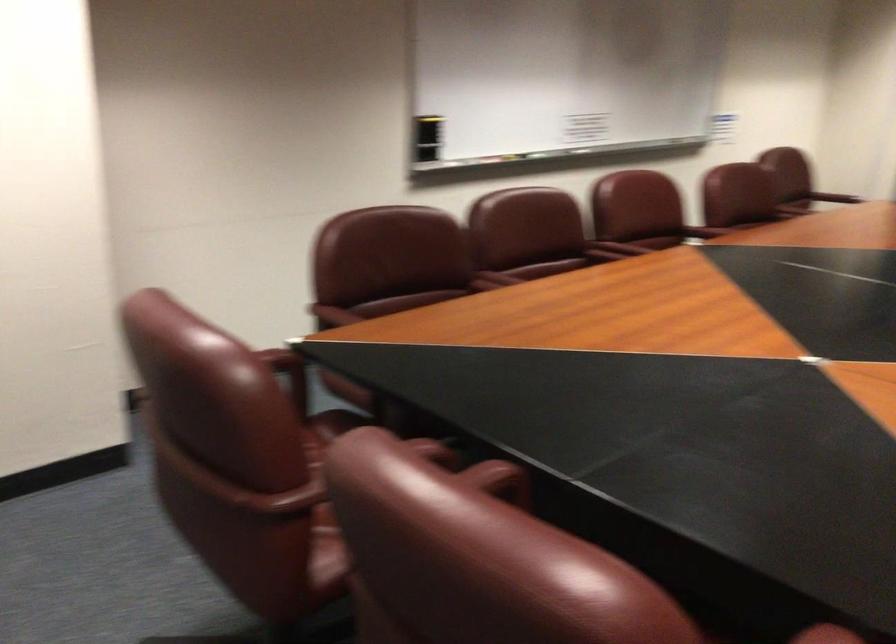
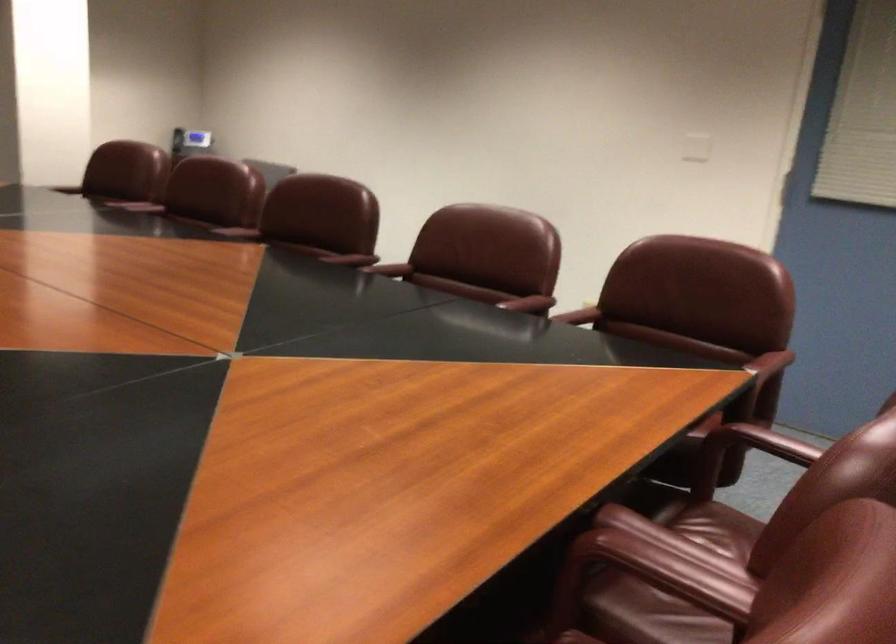
Locate, in the second image, the point that corresponds to point 376,335 in the first image.

(761, 442)